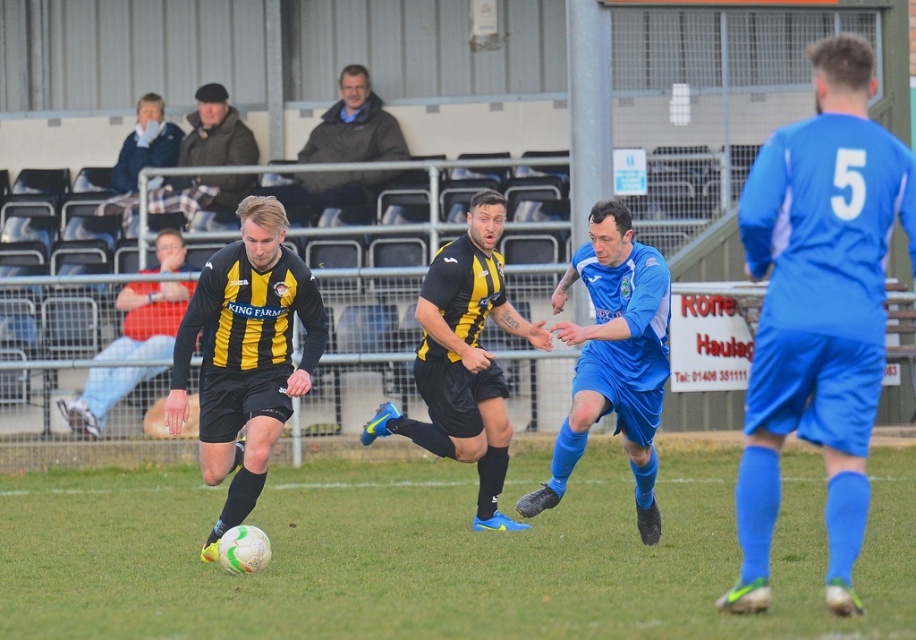
You are a soccer coach analyzing the field layout. Based on the image, which object is shorter between the green grass at center and the blue smooth soccer player at center?

The green grass at center is shorter than the blue smooth soccer player at center.

You are a soccer coach observing the game. You notice the blue matte jersey at right and the ball. How far apart are they?

The blue matte jersey at right and the ball are 8.16 meters apart.